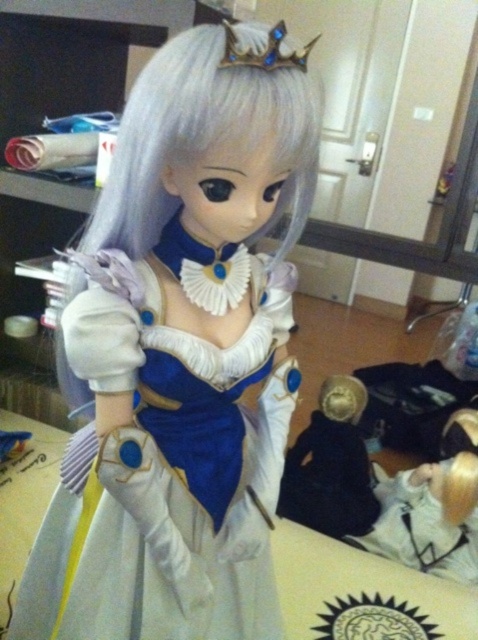
You are a guest at a party and see the satin white dress at center and the black matte doll at lower right. Which object is closer to you?

The satin white dress at center is closer to you because it is in front of the black matte doll at lower right.

You are a tailor who needs to determine if the satin white dress at center can fit over the black matte doll at lower right. Based on the provided information, will the dress fit the doll?

The satin white dress at center has a width larger than the black matte doll at lower right, so the dress will fit over the doll since it is wider.